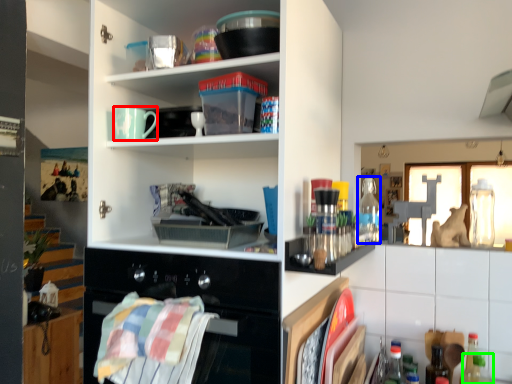
Question: Considering the real-world distances, which object is closest to mug (highlighted by a red box)? bottle (highlighted by a blue box) or bottle (highlighted by a green box).

Choices:
 (A) bottle
 (B) bottle

Answer: (A)